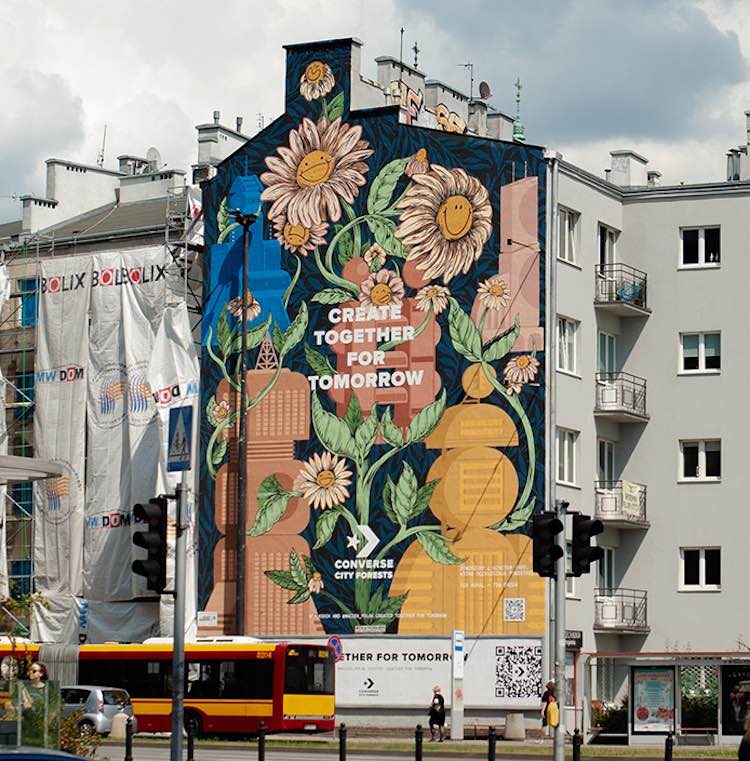
The width and height of the screenshot is (750, 761). I want to click on chimneys, so click(217, 113), click(240, 123).